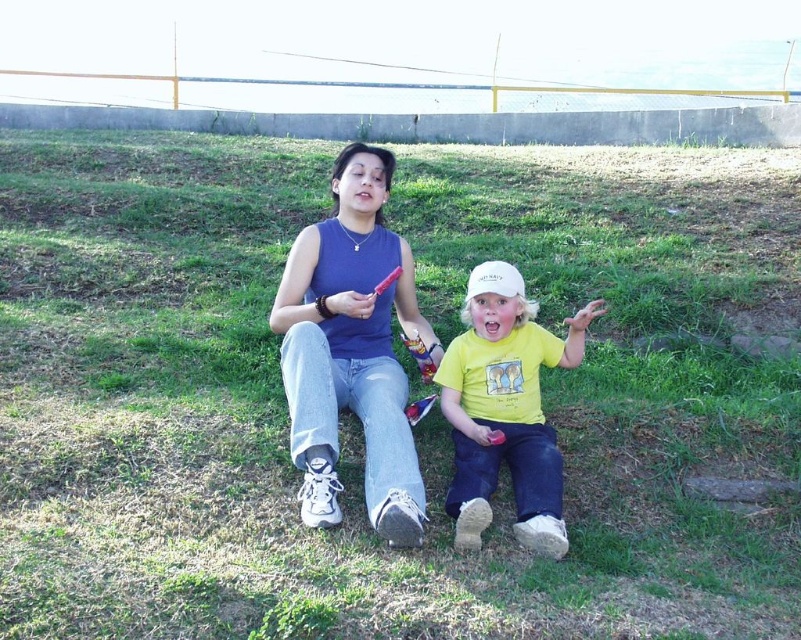
You are a photographer trying to capture a photo of the yellow cotton shirt at center and the white matte baseball hat at center. If you want to frame both items equally in your camera, which one should you move closer to or farther away from the camera?

The yellow cotton shirt at center has a larger width than the white matte baseball hat at center. To frame both items equally, you should move the yellow cotton shirt at center farther away from the camera and bring the white matte baseball hat at center closer. This adjustment will balance their apparent sizes in the photo.